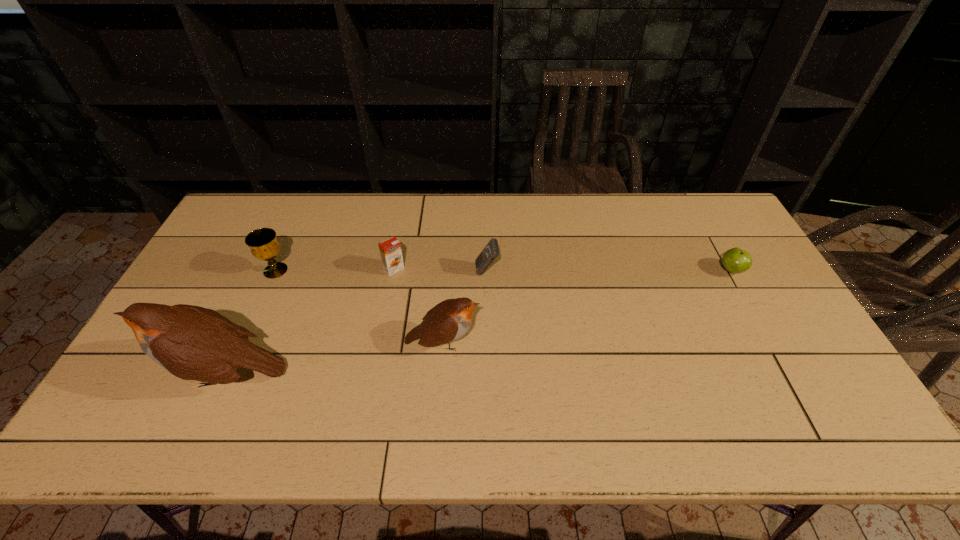
In order to click on vacant space positioned at the face of the tallest object in this screenshot , I will do `click(132, 374)`.

At what (x,y) coordinates should I click in order to perform the action: click on free location located at the face of the shorter bird. Please return your answer as a coordinate pair (x, y). Image resolution: width=960 pixels, height=540 pixels. Looking at the image, I should click on (525, 342).

Locate an element on the screen. The width and height of the screenshot is (960, 540). free space located 0.260m on the front of the chalice is located at coordinates (238, 353).

At what (x,y) coordinates should I click in order to perform the action: click on free region located 0.280m on the right of the orange juice. Please return your answer as a coordinate pair (x, y). The width and height of the screenshot is (960, 540). Looking at the image, I should click on (494, 269).

The height and width of the screenshot is (540, 960). I want to click on vacant space situated on the back of the shortest object, so click(x=712, y=236).

Image resolution: width=960 pixels, height=540 pixels. What are the coordinates of `vacant space located 0.190m on the front-facing side of the calculator` in the screenshot? It's located at (414, 271).

Where is `vacant region located 0.150m on the front-facing side of the calculator`? This screenshot has width=960, height=540. vacant region located 0.150m on the front-facing side of the calculator is located at coordinates (426, 271).

At what (x,y) coordinates should I click in order to perform the action: click on free space located 0.190m on the front-facing side of the calculator. Please return your answer as a coordinate pair (x, y). This screenshot has height=540, width=960. Looking at the image, I should click on (414, 271).

Identify the location of object located at the near edge. (193, 343).

Where is `object present at the left edge`? The image size is (960, 540). object present at the left edge is located at coordinates (193, 343).